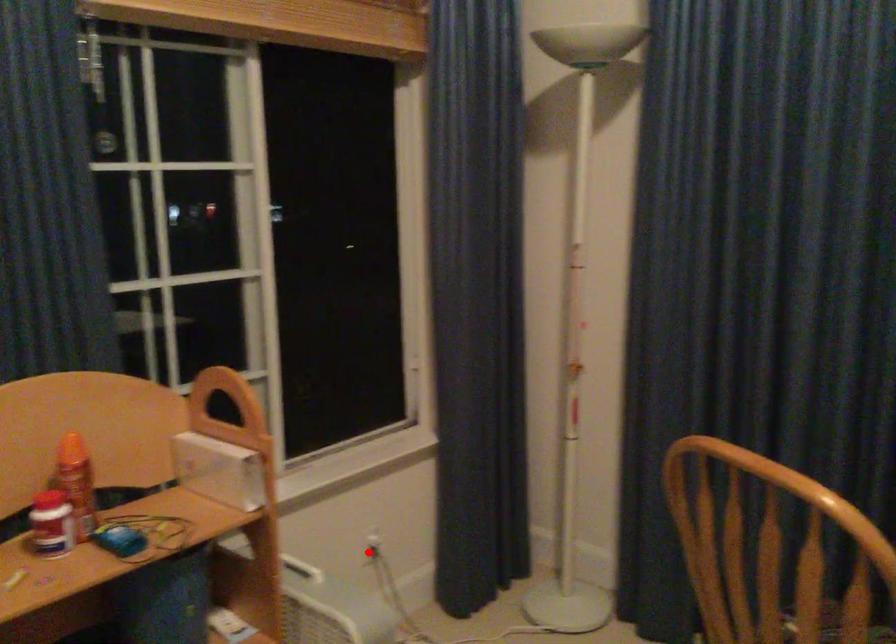
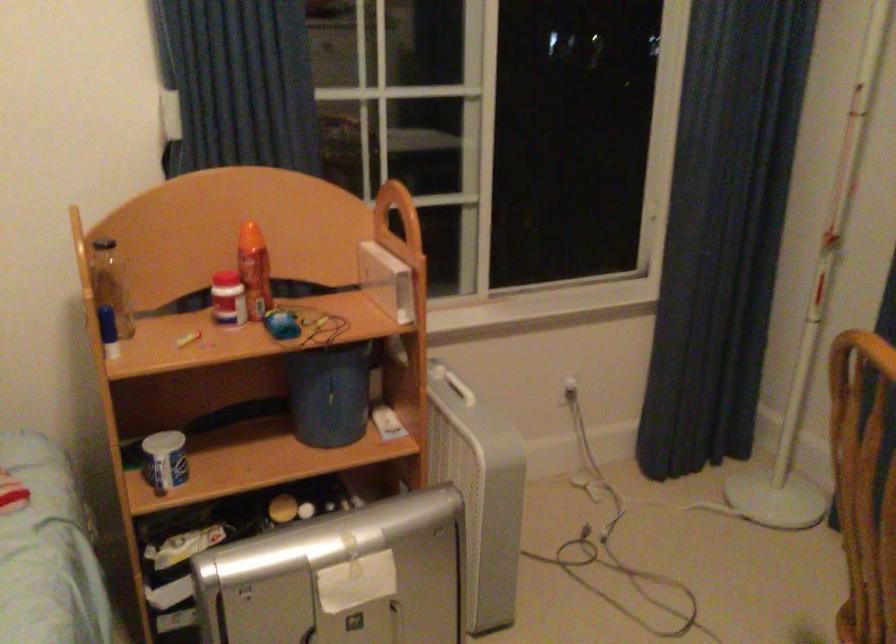
Where in the second image is the point corresponding to the highlighted location from the first image?

(564, 392)